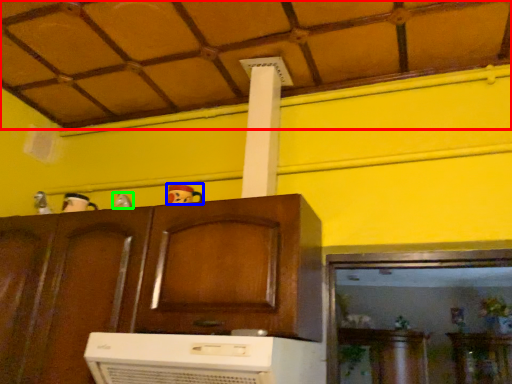
Question: Estimate the real-world distances between objects in this image. Which object is farther from tile roof (highlighted by a red box), toy (highlighted by a blue box) or toy (highlighted by a green box)?

Choices:
 (A) toy
 (B) toy

Answer: (B)